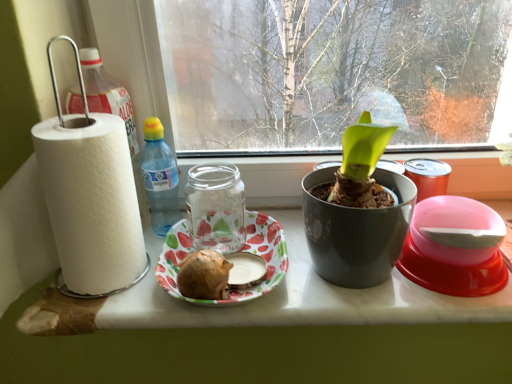
You are a GUI agent. You are given a task and a screenshot of the screen. Output one action in this format:
    pyautogui.click(x=<x>, y=<y>)
    Task: Click on the free location to the left of pink plastic bowl at right
    This screenshot has height=384, width=512.
    Given the screenshot: What is the action you would take?
    pyautogui.click(x=350, y=283)